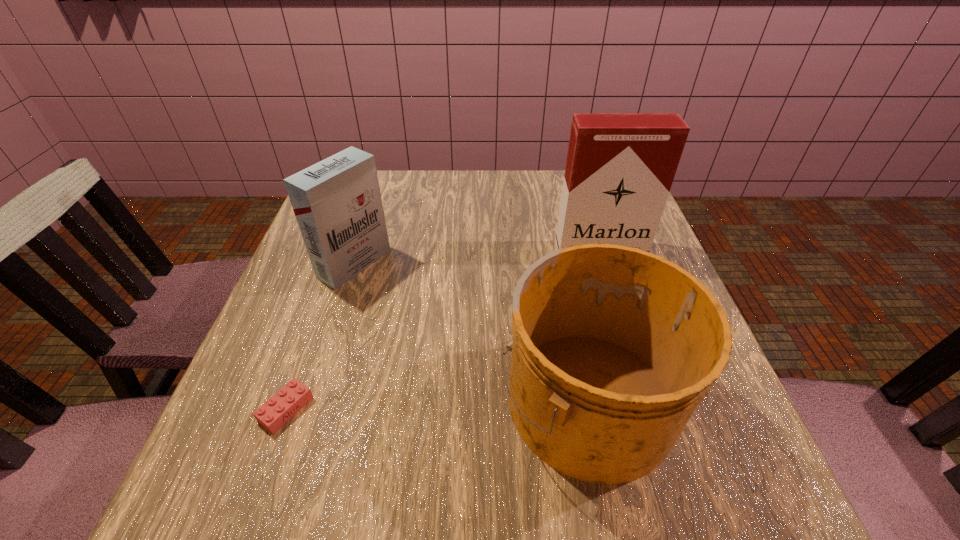
Find the location of `the right cigarette case`. the right cigarette case is located at coordinates (620, 167).

The height and width of the screenshot is (540, 960). Find the location of `the tallest object`. the tallest object is located at coordinates (620, 167).

The width and height of the screenshot is (960, 540). I want to click on the shorter cigarette case, so click(337, 203).

Where is `bucket`? bucket is located at coordinates (613, 348).

Where is `Lego`? This screenshot has width=960, height=540. Lego is located at coordinates (276, 411).

Identify the location of free space located 0.190m on the front-facing side of the taller cigarette case. Image resolution: width=960 pixels, height=540 pixels. (623, 322).

The width and height of the screenshot is (960, 540). I want to click on vacant space located 0.250m on the front of the shorter cigarette case, so click(x=314, y=393).

Locate an element on the screen. The width and height of the screenshot is (960, 540). vacant space located 0.380m on the back of the bucket is located at coordinates (551, 217).

Where is `vacant region located 0.090m on the front of the Lego`? The width and height of the screenshot is (960, 540). vacant region located 0.090m on the front of the Lego is located at coordinates (256, 494).

The image size is (960, 540). Identify the location of object located in the near edge section of the desktop. (613, 348).